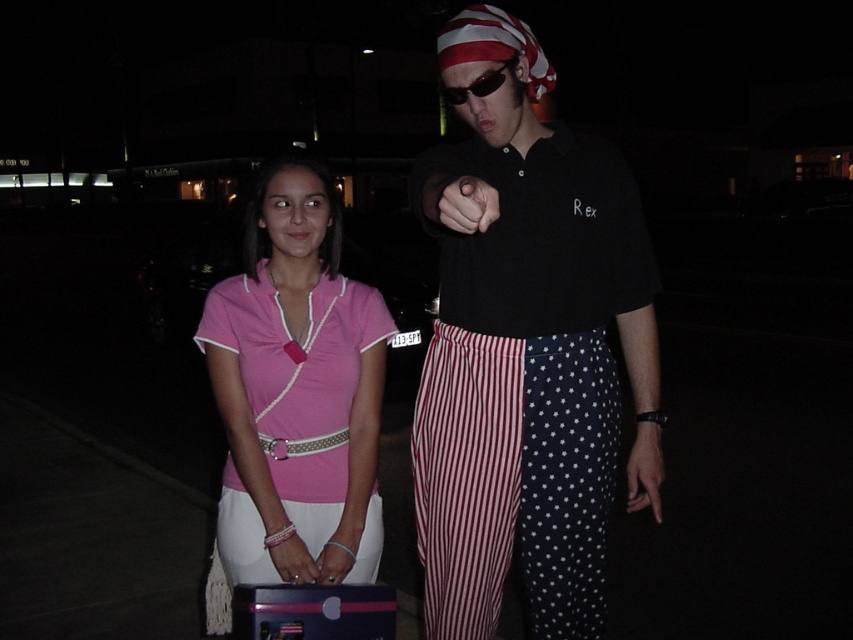
Between black cotton shirt at center and black matte hand at center, which one appears on the left side from the viewer's perspective?

black matte hand at center is more to the left.

Between black cotton shirt at center and black matte hand at center, which one is positioned lower?

black cotton shirt at center is below.

Identify the location of black cotton shirt at center. (527, 353).

Is black cotton shirt at center below pink fabric shirt at center?

No.

Is point (442, 628) more distant than point (320, 168)?

Yes, point (442, 628) is farther from viewer.

Where is `black cotton shirt at center`? The width and height of the screenshot is (853, 640). black cotton shirt at center is located at coordinates (527, 353).

At what (x,y) coordinates should I click in order to perform the action: click on black cotton shirt at center. Please return your answer as a coordinate pair (x, y). This screenshot has width=853, height=640. Looking at the image, I should click on (527, 353).

Between black cotton shirt at center and sunglasses at center, which one has less height?

black cotton shirt at center

At what (x,y) coordinates should I click in order to perform the action: click on black cotton shirt at center. Please return your answer as a coordinate pair (x, y). Looking at the image, I should click on (527, 353).